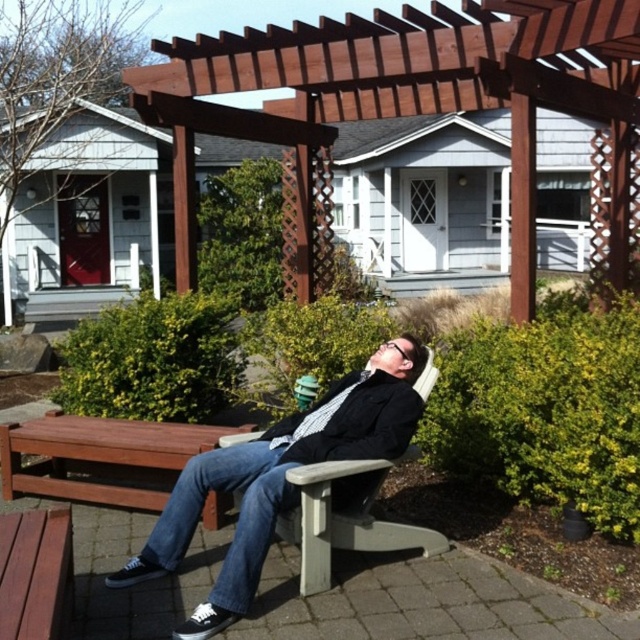
Question: Which is farther from the matte black jacket at center?

Choices:
 (A) brown wood pergola at upper center
 (B) wooden park bench at lower left

Answer: (A)

Question: Which point appears farthest from the camera in this image?

Choices:
 (A) (10, 618)
 (B) (260, 83)
 (C) (336, 481)

Answer: (B)

Question: Is brown wood pergola at upper center above matte black jacket at center?

Choices:
 (A) yes
 (B) no

Answer: (A)

Question: Observing the image, what is the correct spatial positioning of brown wood pergola at upper center in reference to matte black jacket at center?

Choices:
 (A) left
 (B) right

Answer: (B)

Question: Among these points, which one is farthest from the camera?

Choices:
 (A) (64, 589)
 (B) (589, 84)

Answer: (B)

Question: Observing the image, what is the correct spatial positioning of matte black jacket at center in reference to wooden park bench at lower left?

Choices:
 (A) below
 (B) above

Answer: (B)